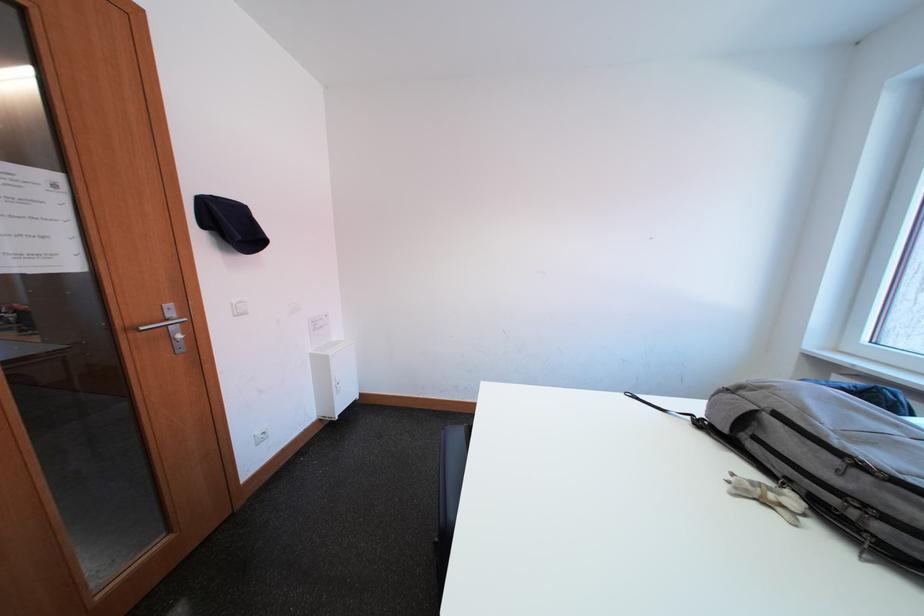
You are a GUI agent. You are given a task and a screenshot of the screen. Output one action in this format:
    pyautogui.click(x=<x>, y=<y>)
    Task: Click on the backpack carry strap
    
    Given the screenshot: What is the action you would take?
    pyautogui.click(x=704, y=431)